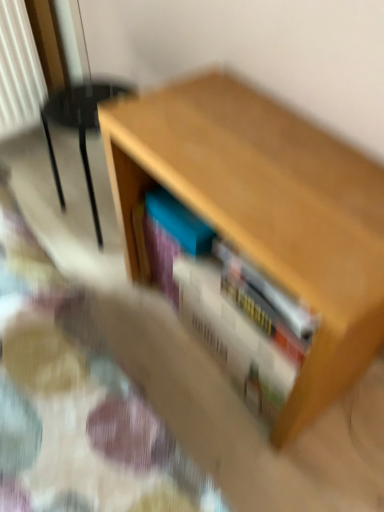
Question: Is white matte book at center wider than wooden table at center?

Choices:
 (A) no
 (B) yes

Answer: (A)

Question: Does white matte book at center have a larger size compared to wooden table at center?

Choices:
 (A) yes
 (B) no

Answer: (B)

Question: Is white matte book at center positioned with its back to wooden table at center?

Choices:
 (A) no
 (B) yes

Answer: (B)

Question: Is white matte book at center further to camera compared to wooden table at center?

Choices:
 (A) no
 (B) yes

Answer: (B)

Question: Would you say wooden table at center is part of white matte book at center's contents?

Choices:
 (A) no
 (B) yes

Answer: (A)

Question: Looking at their shapes, would you say white matte book at center is wider or thinner than blue matte book at center?

Choices:
 (A) wide
 (B) thin

Answer: (A)

Question: From the image's perspective, relative to blue matte book at center, is white matte book at center above or below?

Choices:
 (A) above
 (B) below

Answer: (B)

Question: From their relative heights in the image, would you say white matte book at center is taller or shorter than blue matte book at center?

Choices:
 (A) tall
 (B) short

Answer: (A)

Question: From a real-world perspective, is white matte book at center physically located above or below blue matte book at center?

Choices:
 (A) below
 (B) above

Answer: (A)

Question: Considering the positions of point (264, 309) and point (322, 281), is point (264, 309) closer or farther from the camera than point (322, 281)?

Choices:
 (A) farther
 (B) closer

Answer: (A)

Question: Is white matte book at center to the left or to the right of wooden table at center in the image?

Choices:
 (A) left
 (B) right

Answer: (B)

Question: From a real-world perspective, relative to wooden table at center, is white matte book at center vertically above or below?

Choices:
 (A) above
 (B) below

Answer: (B)

Question: Considering their positions, is white matte book at center located in front of or behind wooden table at center?

Choices:
 (A) front
 (B) behind

Answer: (B)

Question: Considering the positions of point (56, 185) and point (142, 225), is point (56, 185) closer or farther from the camera than point (142, 225)?

Choices:
 (A) farther
 (B) closer

Answer: (A)

Question: Based on their sizes in the image, would you say velvet beige armchair at left is bigger or smaller than white matte book at center?

Choices:
 (A) small
 (B) big

Answer: (B)